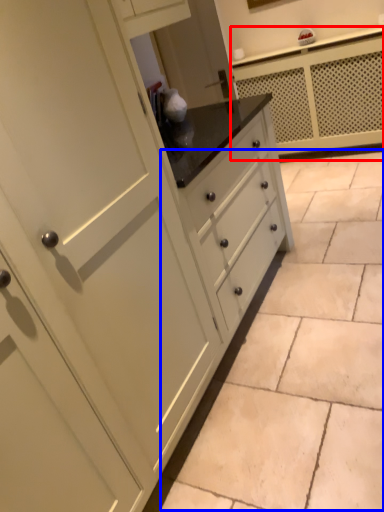
Question: Which of the following is the farthest to the observer, counter (highlighted by a red box) or ceramic tile (highlighted by a blue box)?

Choices:
 (A) counter
 (B) ceramic tile

Answer: (A)